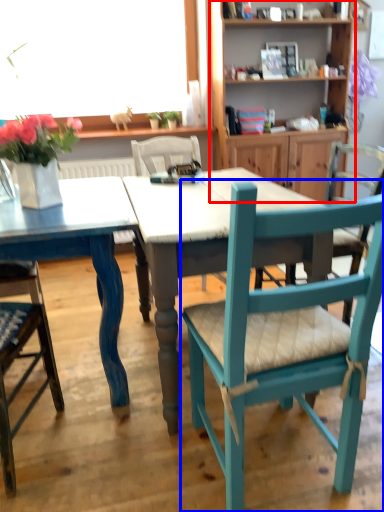
Question: Which object appears closest to the camera in this image, shelf (highlighted by a red box) or chair (highlighted by a blue box)?

Choices:
 (A) shelf
 (B) chair

Answer: (B)